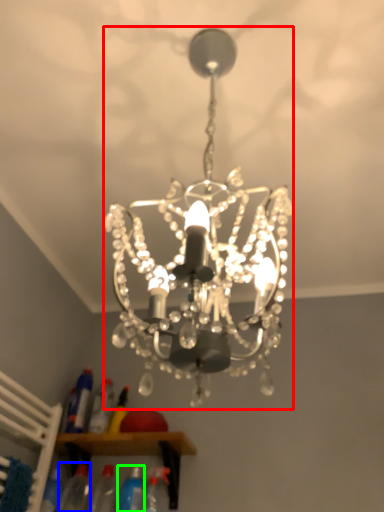
Question: Which is farther away from lamp (highlighted by a red box)? bottle (highlighted by a blue box) or bottle (highlighted by a green box)?

Choices:
 (A) bottle
 (B) bottle

Answer: (A)